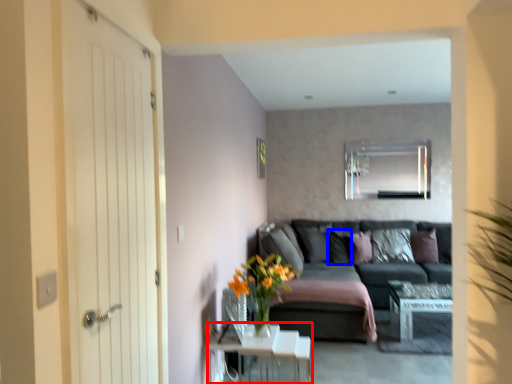
Question: Which object is further to the camera taking this photo, table (highlighted by a red box) or pillow (highlighted by a blue box)?

Choices:
 (A) table
 (B) pillow

Answer: (B)